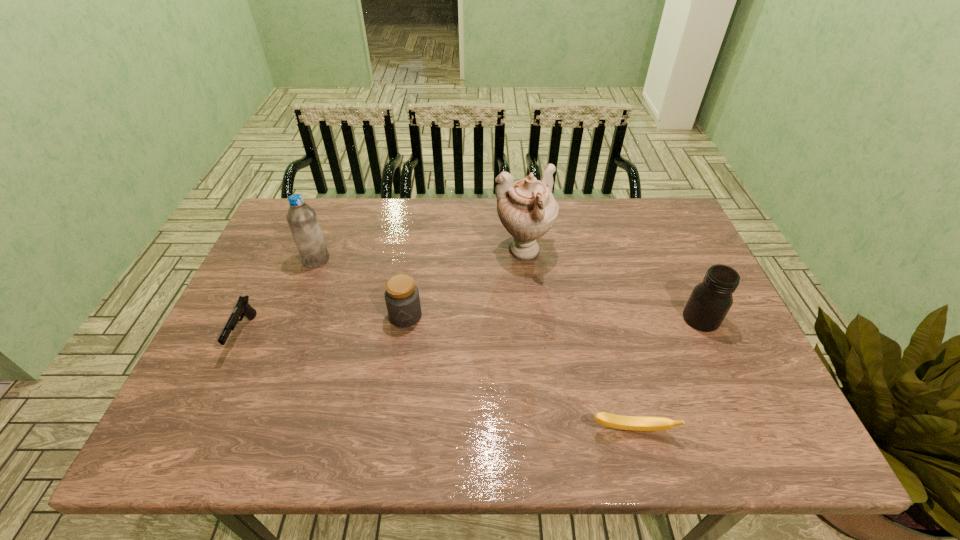
Locate an element on the screen. free space that satisfies the following two spatial constraints: 1. on the surface of the third object from left to right near the warning symbol; 2. on the right side of the right jar is located at coordinates (405, 319).